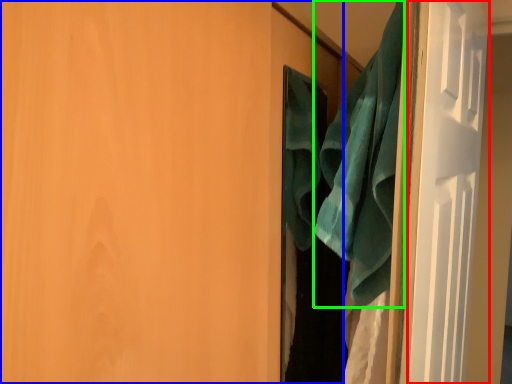
Question: Which is farther away from screen door (highlighted by a red box)? door (highlighted by a blue box) or beach towel (highlighted by a green box)?

Choices:
 (A) door
 (B) beach towel

Answer: (A)